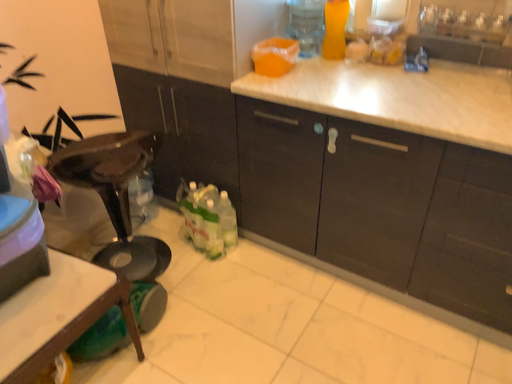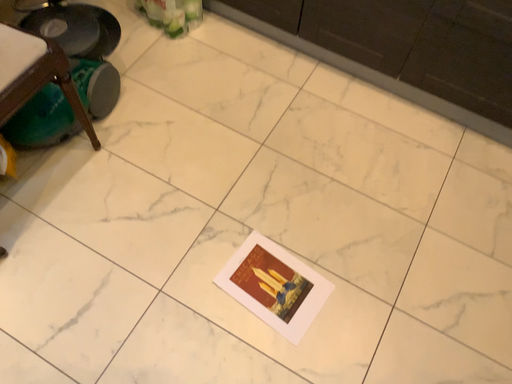
Question: How did the camera likely rotate when shooting the video?

Choices:
 (A) rotated downward
 (B) rotated upward

Answer: (A)